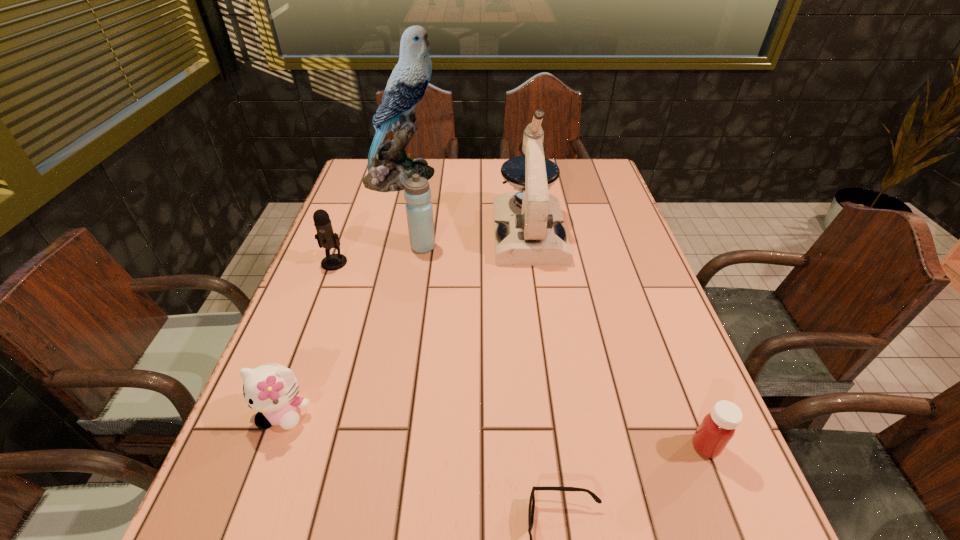
Identify the location of free space that satisfies the following two spatial constraints: 1. on the face of the farthest object; 2. on the front side of the fourth shortest object. (379, 262).